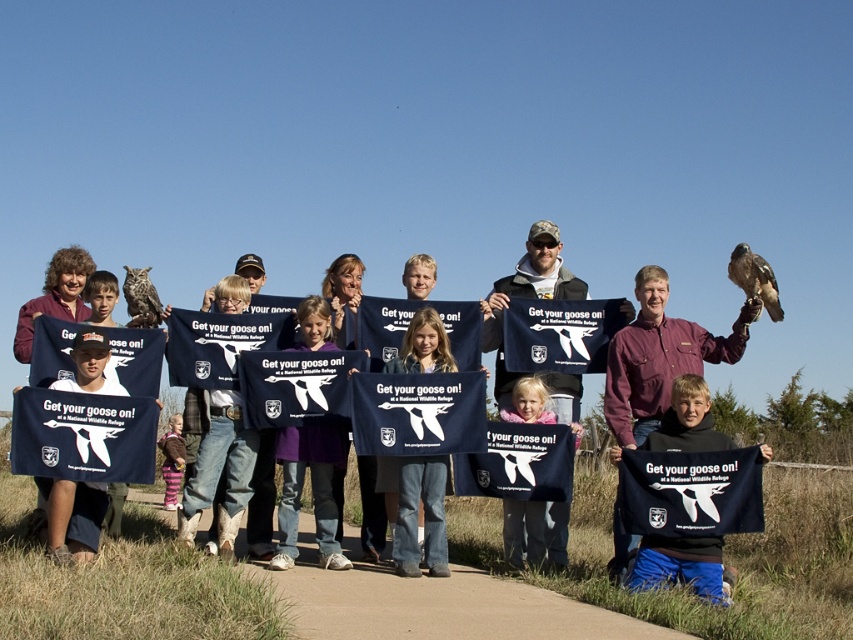
Question: Can you confirm if matte black t-shirt at center is bigger than dark blue t-shirt at center?

Choices:
 (A) yes
 (B) no

Answer: (A)

Question: Considering the real-world distances, which object is farthest from the fluffy pink coat at lower center?

Choices:
 (A) blue denim jeans at center
 (B) dark blue t-shirt at center

Answer: (A)

Question: Which of the following is the farthest from the observer?

Choices:
 (A) matte brown owl at upper left
 (B) denim jeans at center

Answer: (A)

Question: Which of the following is the closest to the observer?

Choices:
 (A) blue denim jeans at center
 (B) brown feathered falcon at upper right

Answer: (A)

Question: Can you confirm if black fabric t-shirt at center is positioned above fluffy pink coat at lower center?

Choices:
 (A) no
 (B) yes

Answer: (B)

Question: In this image, where is denim jeans at center located relative to striped sweater at lower left?

Choices:
 (A) left
 (B) right

Answer: (B)